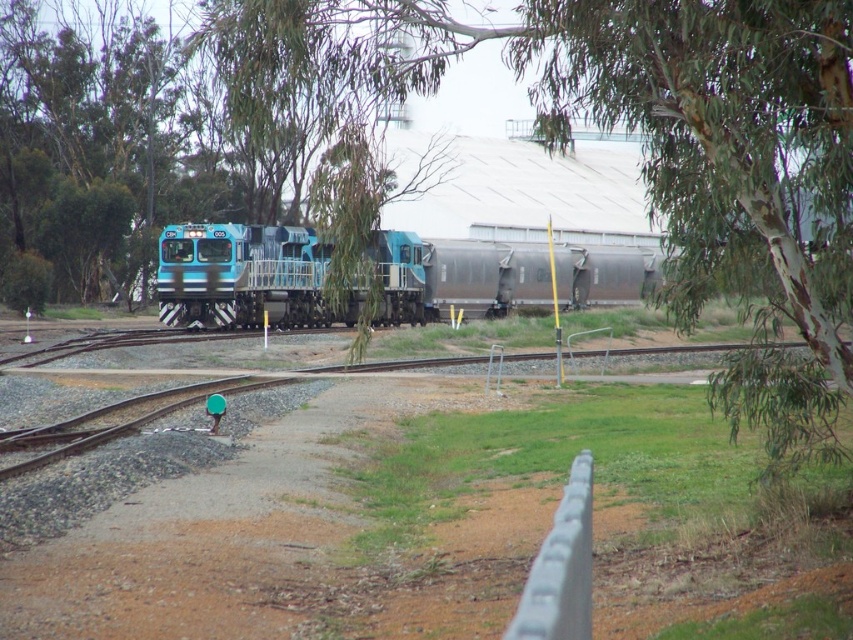
Question: Which point is closer to the camera?

Choices:
 (A) gray metallic rail at lower center
 (B) green leafy tree at upper center

Answer: (A)

Question: Estimate the real-world distances between objects in this image. Which object is farther from the gray metallic rail at lower center?

Choices:
 (A) green leafy tree at upper center
 (B) blue metallic train at center

Answer: (B)

Question: Which object is farther from the camera taking this photo?

Choices:
 (A) blue metallic train at center
 (B) gray metallic rail at lower center

Answer: (A)

Question: Does green leafy tree at upper center have a lesser width compared to blue metallic train at center?

Choices:
 (A) yes
 (B) no

Answer: (B)

Question: Can you confirm if blue metallic train at center is positioned below gray metallic rail at lower center?

Choices:
 (A) yes
 (B) no

Answer: (B)

Question: From the image, what is the correct spatial relationship of green leafy tree at upper center in relation to blue metallic train at center?

Choices:
 (A) above
 (B) below

Answer: (A)